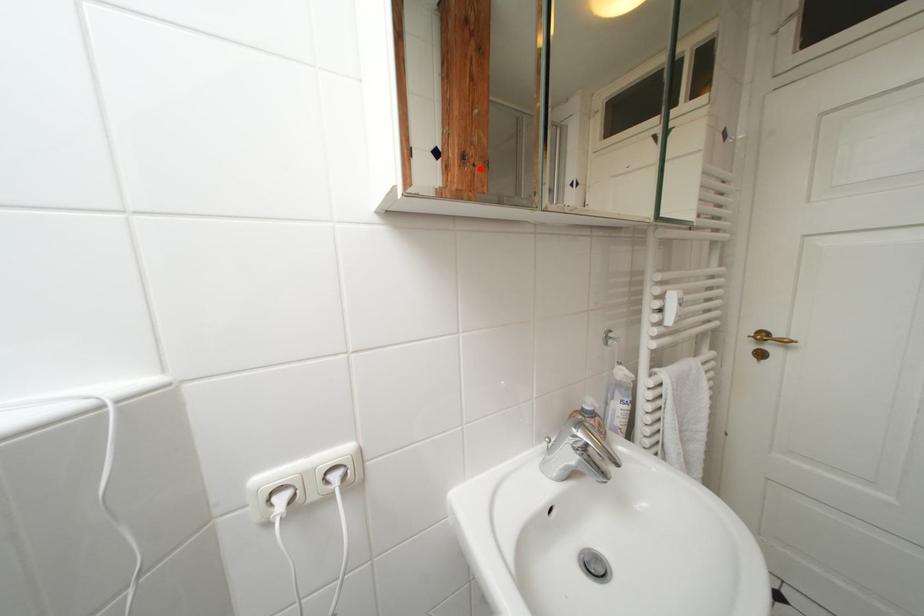
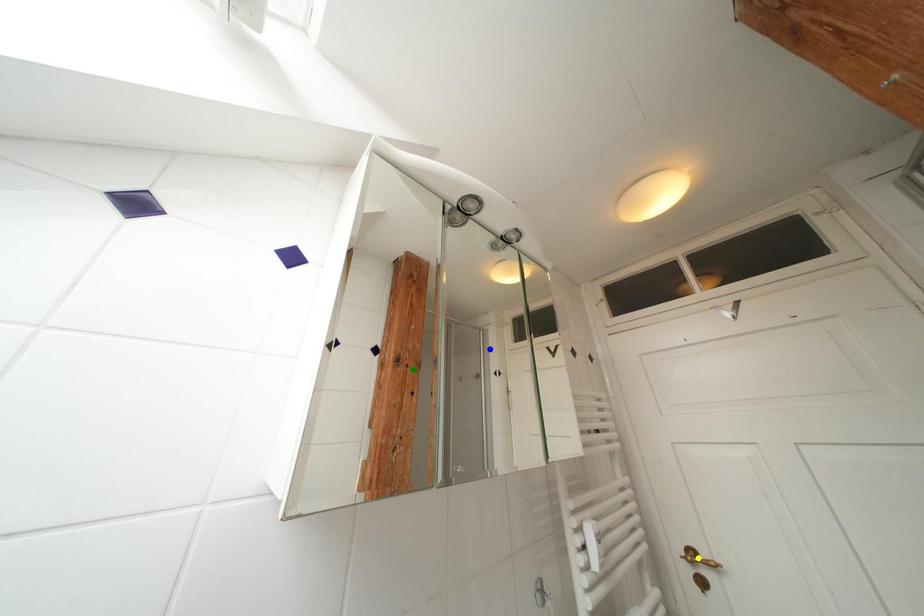
Question: I am providing you with two images of the same scene from different viewpoints. A red point is marked on the first image. You are given multiple points on the second image. Which point in image 2 represents the same 3d spot as the red point in image 1?

Choices:
 (A) green point
 (B) yellow point
 (C) blue point

Answer: (A)